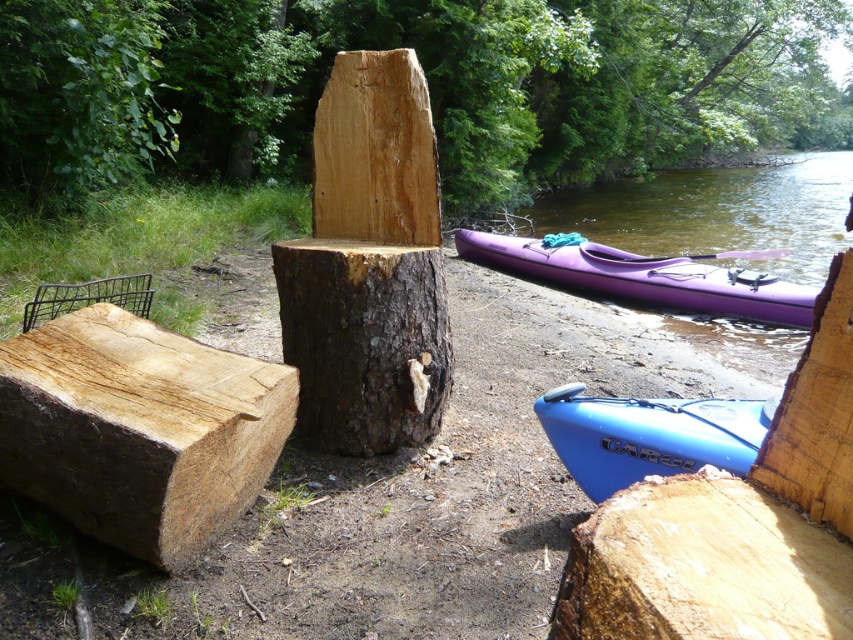
Based on the photo, between blue matte kayak at lower right and wooden plank at right, which one has more height?

Standing taller between the two is wooden plank at right.

Does blue matte kayak at lower right appear under wooden plank at right?

Indeed, blue matte kayak at lower right is positioned under wooden plank at right.

Is point (554, 400) more distant than point (781, 429)?

Yes, point (554, 400) is farther from viewer.

Find the location of a particular element. blue matte kayak at lower right is located at coordinates (648, 435).

Is natural light wood log at left to the left of purple wood paddle at right from the viewer's perspective?

Yes, natural light wood log at left is to the left of purple wood paddle at right.

Can you confirm if natural light wood log at left is thinner than purple wood paddle at right?

No.

At what (x,y) coordinates should I click in order to perform the action: click on natural light wood log at left. Please return your answer as a coordinate pair (x, y). The width and height of the screenshot is (853, 640). Looking at the image, I should click on (138, 428).

Locate an element on the screen. This screenshot has width=853, height=640. natural light wood log at left is located at coordinates (138, 428).

Does natural wood log at center appear on the right side of green leafy tree at upper left?

Indeed, natural wood log at center is positioned on the right side of green leafy tree at upper left.

Is natural wood log at center shorter than green leafy tree at upper left?

Incorrect, natural wood log at center's height does not fall short of green leafy tree at upper left's.

This screenshot has width=853, height=640. What are the coordinates of `natural wood log at center` in the screenshot? It's located at (427, 83).